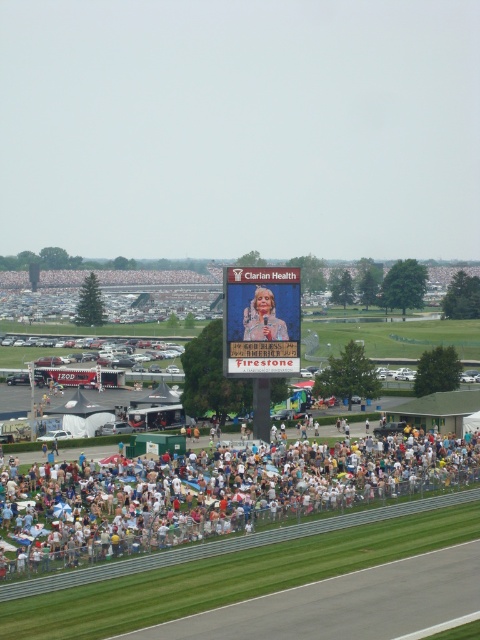
Question: Among these points, which one is nearest to the camera?

Choices:
 (A) (304, 515)
 (B) (264, 289)

Answer: (A)

Question: Among these objects, which one is nearest to the camera?

Choices:
 (A) matte black person at lower center
 (B) matte pink dress at center

Answer: (A)

Question: Can you confirm if matte black person at lower center is positioned to the left of matte pink dress at center?

Choices:
 (A) no
 (B) yes

Answer: (A)

Question: Does matte black person at lower center have a greater width compared to matte pink dress at center?

Choices:
 (A) no
 (B) yes

Answer: (B)

Question: Does matte black person at lower center have a larger size compared to matte pink dress at center?

Choices:
 (A) no
 (B) yes

Answer: (B)